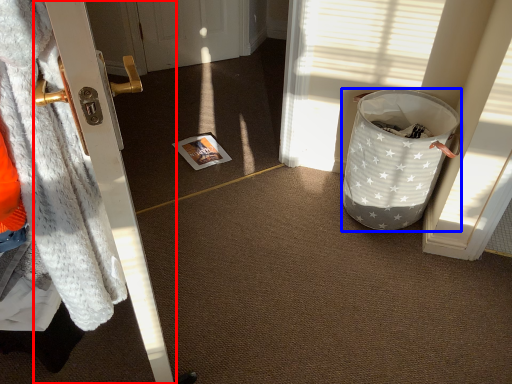
Question: Which object is closer to the camera taking this photo, door (highlighted by a red box) or trash bin/can (highlighted by a blue box)?

Choices:
 (A) door
 (B) trash bin/can

Answer: (A)